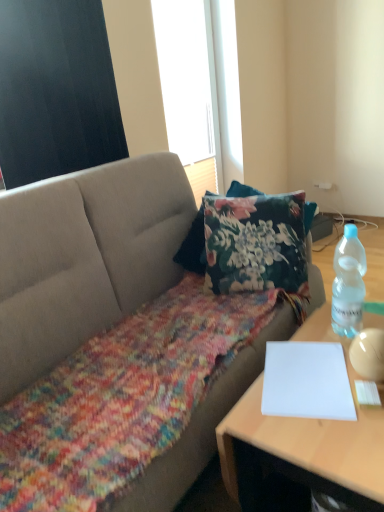
Question: Does clear plastic bottle at right have a lesser height compared to white paper at lower right?

Choices:
 (A) no
 (B) yes

Answer: (A)

Question: From a real-world perspective, is clear plastic bottle at right on white paper at lower right?

Choices:
 (A) yes
 (B) no

Answer: (A)

Question: From the image's perspective, is clear plastic bottle at right below white paper at lower right?

Choices:
 (A) yes
 (B) no

Answer: (B)

Question: Is the position of clear plastic bottle at right more distant than that of white paper at lower right?

Choices:
 (A) no
 (B) yes

Answer: (B)

Question: Can you confirm if clear plastic bottle at right is smaller than white paper at lower right?

Choices:
 (A) no
 (B) yes

Answer: (A)

Question: From the image's perspective, is white matte window screen at upper center, the first window screen when ordered from back to front, above or below white paper at right?

Choices:
 (A) below
 (B) above

Answer: (B)

Question: Looking at their shapes, would you say white matte window screen at upper center, the first window screen when ordered from back to front, is wider or thinner than white paper at right?

Choices:
 (A) wide
 (B) thin

Answer: (B)

Question: From a real-world perspective, relative to white paper at right, is white matte window screen at upper center, which is the 1th window screen from right to left, vertically above or below?

Choices:
 (A) above
 (B) below

Answer: (A)

Question: Based on their positions, is white matte window screen at upper center, positioned as the 2th window screen in left-to-right order, located to the left or right of white paper at right?

Choices:
 (A) right
 (B) left

Answer: (B)

Question: Considering their positions, is white matte window screen at upper center, positioned as the 2th window screen in front-to-back order, located in front of or behind textured gray couch at center?

Choices:
 (A) front
 (B) behind

Answer: (B)

Question: From the image's perspective, is white matte window screen at upper center, positioned as the 2th window screen in front-to-back order, above or below textured gray couch at center?

Choices:
 (A) above
 (B) below

Answer: (A)

Question: Is white matte window screen at upper center, which is the 1th window screen from right to left, to the left or to the right of textured gray couch at center in the image?

Choices:
 (A) right
 (B) left

Answer: (A)

Question: In terms of size, does white matte window screen at upper center, positioned as the 2th window screen in front-to-back order, appear bigger or smaller than textured gray couch at center?

Choices:
 (A) small
 (B) big

Answer: (A)

Question: In the image, is clear plastic bottle at right on the left side or the right side of white paper at right?

Choices:
 (A) left
 (B) right

Answer: (B)

Question: From the image's perspective, is clear plastic bottle at right located above or below white paper at right?

Choices:
 (A) below
 (B) above

Answer: (B)